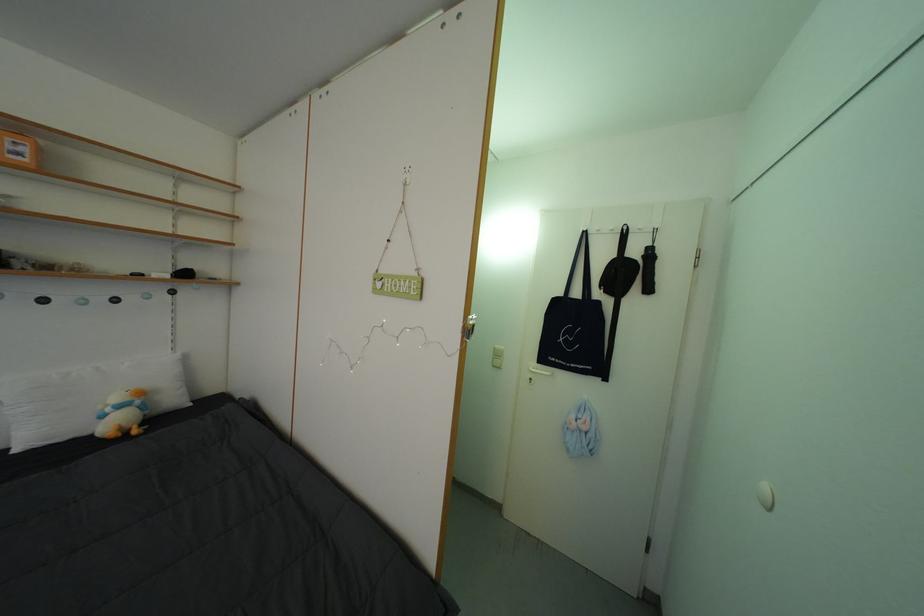
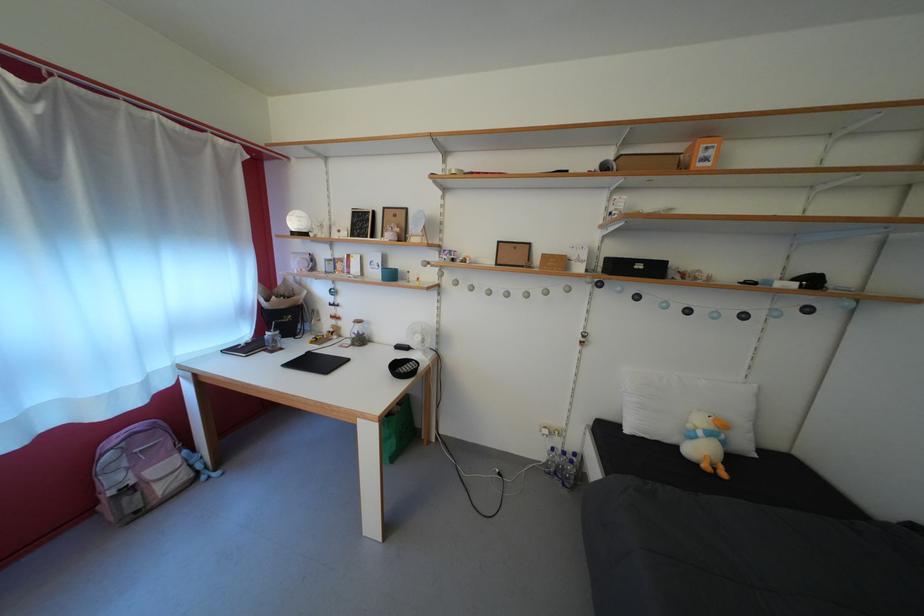
In the second image, find the point that corresponds to [117,415] in the first image.

(709, 439)